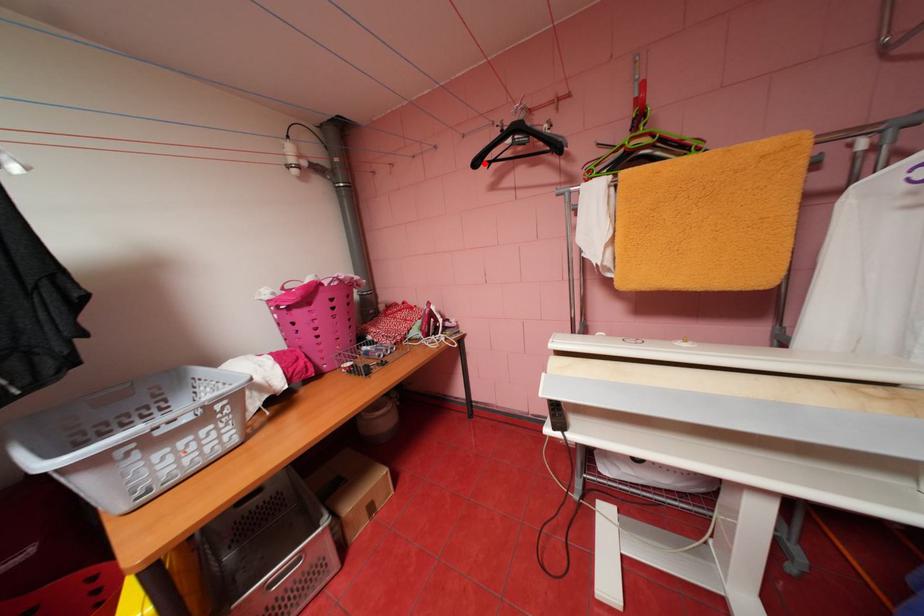
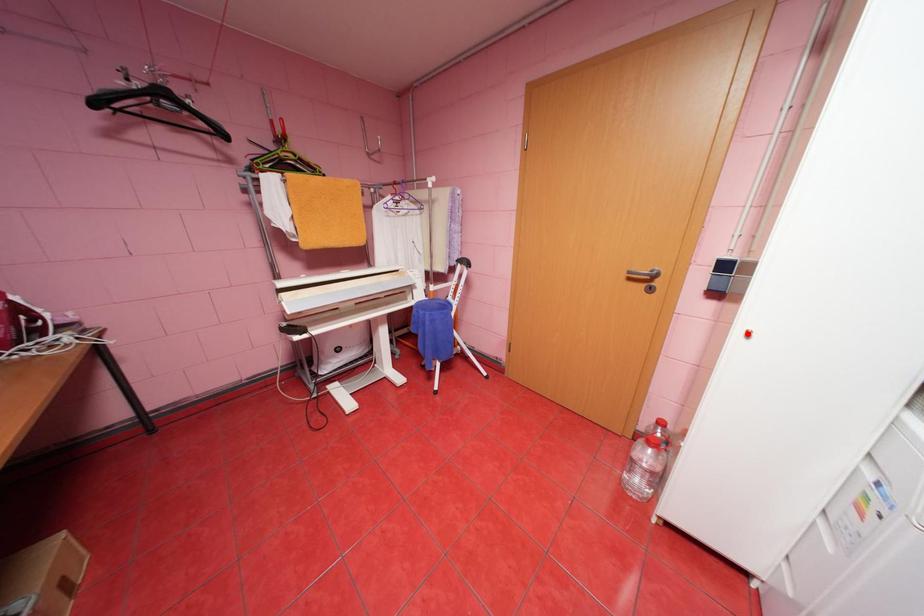
I am providing you with two images of the same scene from different viewpoints. A red point is marked on the first image and another point is marked on the second image. Are the points marked in image1 and image2 representing the same 3D position?

No